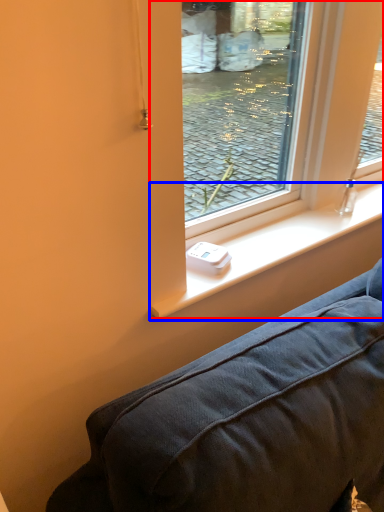
Question: Which of the following is the farthest to the observer, window screen (highlighted by a red box) or window sill (highlighted by a blue box)?

Choices:
 (A) window screen
 (B) window sill

Answer: (B)